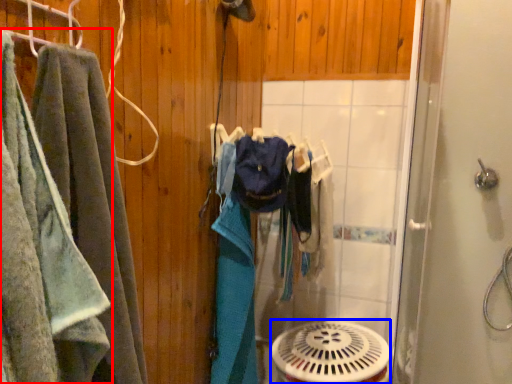
Question: Which of the following is the closest to the observer, towel (highlighted by a red box) or mechanical fan (highlighted by a blue box)?

Choices:
 (A) towel
 (B) mechanical fan

Answer: (A)